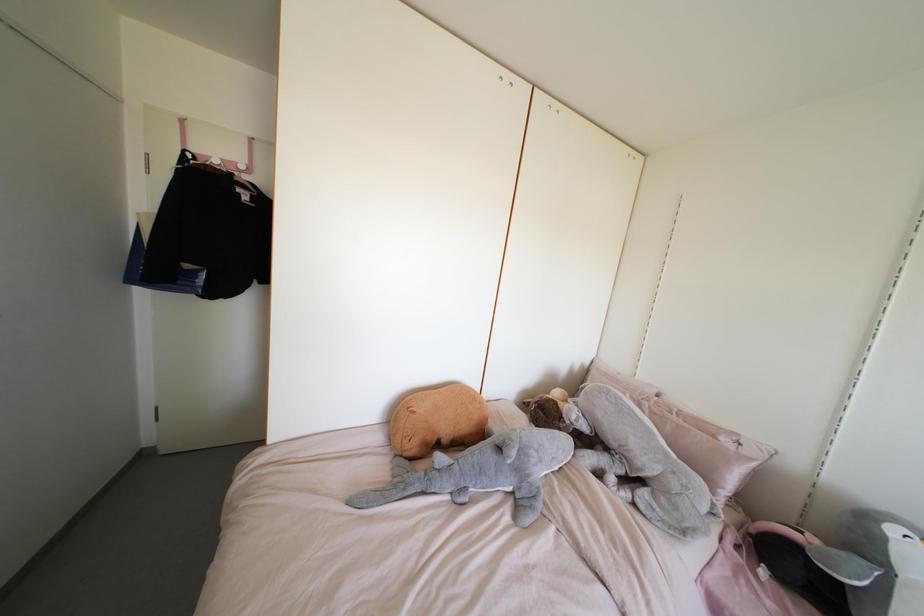
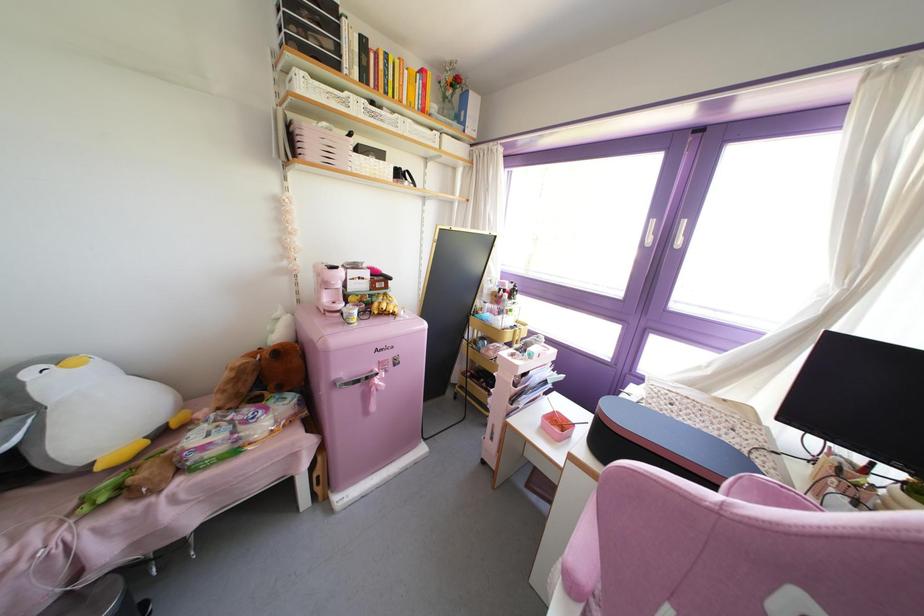
Based on the continuous images, in which direction is the camera rotating?

The camera's rotation is toward right-down.